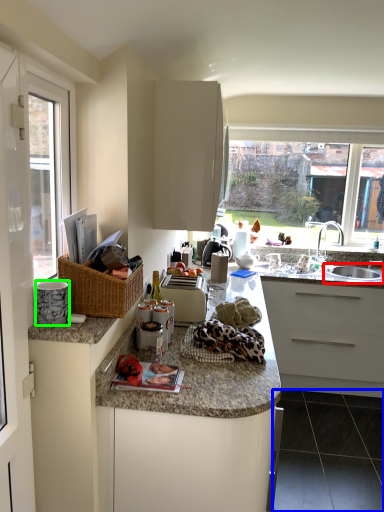
Question: Which object is positioned closest to sink (highlighted by a red box)? Select from tile (highlighted by a blue box) and appliance (highlighted by a green box).

Choices:
 (A) tile
 (B) appliance

Answer: (A)